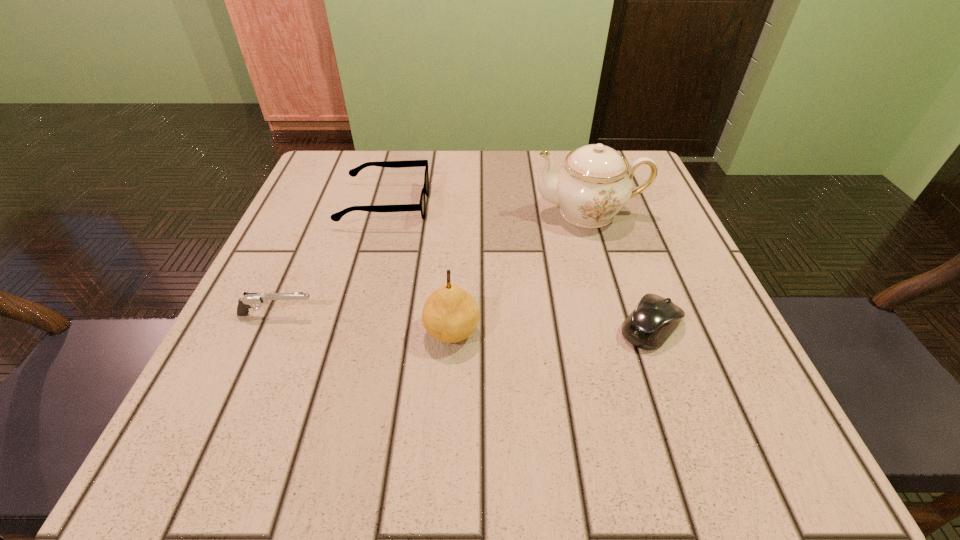
Locate an element on the screen. This screenshot has width=960, height=540. vacant point located between the spectacles and the chinaware is located at coordinates (487, 208).

Find the location of a particular element. free area in between the mouse and the tallest object is located at coordinates (620, 269).

I want to click on vacant region between the tallest object and the pear, so click(520, 272).

Identify the location of empty location between the pistol and the spectacles. (331, 260).

Identify the location of vacant space that is in between the spectacles and the second tallest object. (419, 268).

Identify which object is the closest to the chinaware. Please provide its 2D coordinates. Your answer should be formatted as a tuple, i.e. [(x, y)], where the tuple contains the x and y coordinates of a point satisfying the conditions above.

[(654, 319)]

You are a GUI agent. You are given a task and a screenshot of the screen. Output one action in this format:
    pyautogui.click(x=<x>, y=<y>)
    Task: Click on the object that ranks as the fourth closest to the pistol
    
    Given the screenshot: What is the action you would take?
    pyautogui.click(x=654, y=319)

Find the location of a particular element. free region that satisfies the following two spatial constraints: 1. on the arms of the third object from right to left; 2. on the left side of the spectacles is located at coordinates (350, 331).

Locate an element on the screen. This screenshot has height=540, width=960. free space that satisfies the following two spatial constraints: 1. at the spout of the tallest object; 2. on the front side of the second tallest object is located at coordinates (625, 331).

Where is `vacant space that satisfies the following two spatial constraints: 1. at the spout of the mouse; 2. on the right side of the chinaware`? This screenshot has width=960, height=540. vacant space that satisfies the following two spatial constraints: 1. at the spout of the mouse; 2. on the right side of the chinaware is located at coordinates (624, 326).